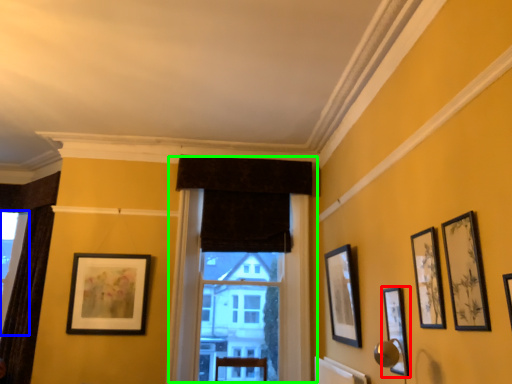
Question: Which object is positioned closest to picture frame (highlighted by a red box)? Select from window (highlighted by a blue box) and window (highlighted by a green box).

Choices:
 (A) window
 (B) window

Answer: (B)